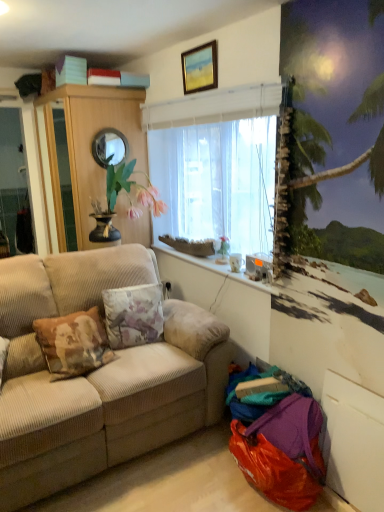
Question: From a real-world perspective, is white glossy coffee cup at lower right physically below wooden picture frame at upper center?

Choices:
 (A) yes
 (B) no

Answer: (A)

Question: Is wooden picture frame at upper center located within white glossy coffee cup at lower right?

Choices:
 (A) no
 (B) yes

Answer: (A)

Question: Does white glossy coffee cup at lower right have a lesser height compared to wooden picture frame at upper center?

Choices:
 (A) no
 (B) yes

Answer: (B)

Question: From the image's perspective, is white glossy coffee cup at lower right above wooden picture frame at upper center?

Choices:
 (A) no
 (B) yes

Answer: (A)

Question: Considering the relative sizes of white glossy coffee cup at lower right and wooden picture frame at upper center in the image provided, is white glossy coffee cup at lower right wider than wooden picture frame at upper center?

Choices:
 (A) no
 (B) yes

Answer: (B)

Question: Considering the relative positions of white glossy coffee cup at lower right and wooden picture frame at upper center in the image provided, is white glossy coffee cup at lower right to the left of wooden picture frame at upper center from the viewer's perspective?

Choices:
 (A) yes
 (B) no

Answer: (B)

Question: Is beige corduroy couch at left further to camera compared to wooden picture frame at upper center?

Choices:
 (A) no
 (B) yes

Answer: (A)

Question: Would you say beige corduroy couch at left is a long distance from wooden picture frame at upper center?

Choices:
 (A) no
 (B) yes

Answer: (B)

Question: Does beige corduroy couch at left come in front of wooden picture frame at upper center?

Choices:
 (A) yes
 (B) no

Answer: (A)

Question: Considering the relative sizes of beige corduroy couch at left and wooden picture frame at upper center in the image provided, is beige corduroy couch at left shorter than wooden picture frame at upper center?

Choices:
 (A) yes
 (B) no

Answer: (B)

Question: Does beige corduroy couch at left turn towards wooden picture frame at upper center?

Choices:
 (A) yes
 (B) no

Answer: (B)

Question: From a real-world perspective, is beige corduroy couch at left on wooden picture frame at upper center?

Choices:
 (A) no
 (B) yes

Answer: (A)

Question: Considering the relative sizes of floral fabric pillow at center and wooden picture frame at upper center in the image provided, is floral fabric pillow at center wider than wooden picture frame at upper center?

Choices:
 (A) no
 (B) yes

Answer: (B)